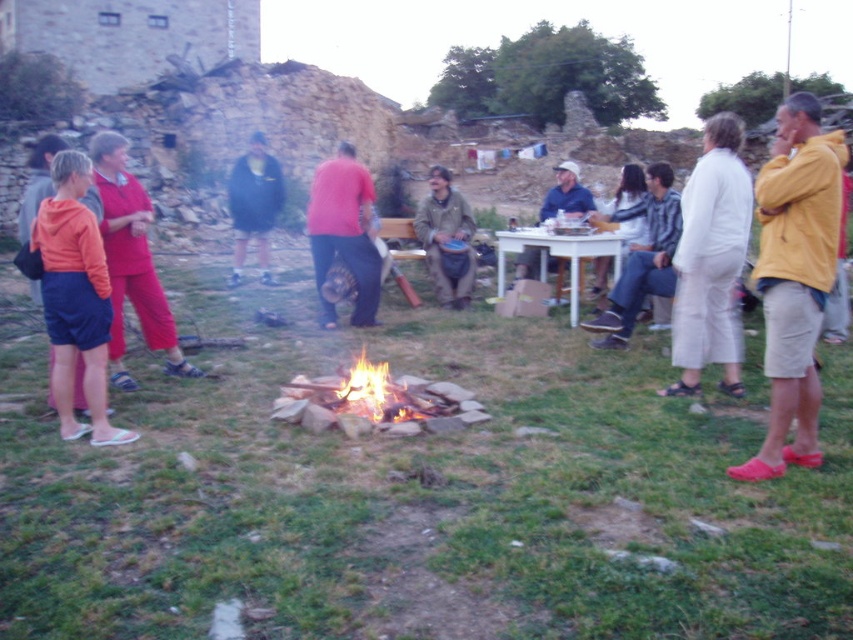
Question: Is white cotton pants at center wider than green fabric jacket at center?

Choices:
 (A) no
 (B) yes

Answer: (B)

Question: Estimate the real-world distances between objects in this image. Which object is farther from the dark blue jacket at center?

Choices:
 (A) orange fabric shorts at lower left
 (B) green fabric jacket at center

Answer: (A)

Question: Among these points, which one is farthest from the camera?

Choices:
 (A) (468, 250)
 (B) (718, 193)
 (C) (238, 211)
 (D) (354, 410)

Answer: (C)

Question: Considering the relative positions of matte pink shirt at center and flaming wood at center in the image provided, where is matte pink shirt at center located with respect to flaming wood at center?

Choices:
 (A) above
 (B) below

Answer: (A)

Question: Considering the real-world distances, which object is closest to the white cotton pants at center?

Choices:
 (A) dark blue jacket at center
 (B) green fabric jacket at center
 (C) flaming wood at center
 (D) matte pink shirt at center

Answer: (C)

Question: Is orange fabric shorts at lower left positioned in front of flaming wood at center?

Choices:
 (A) no
 (B) yes

Answer: (B)